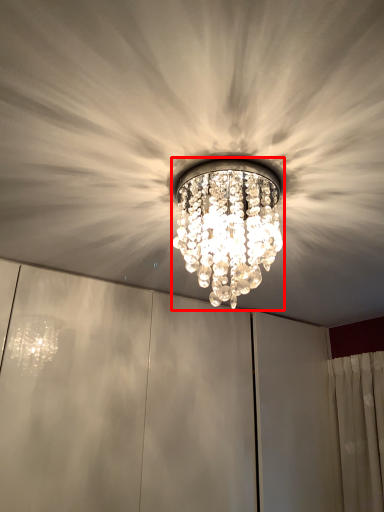
Question: In this image, where is lamp (annotated by the red box) located relative to fan?

Choices:
 (A) left
 (B) right

Answer: (A)